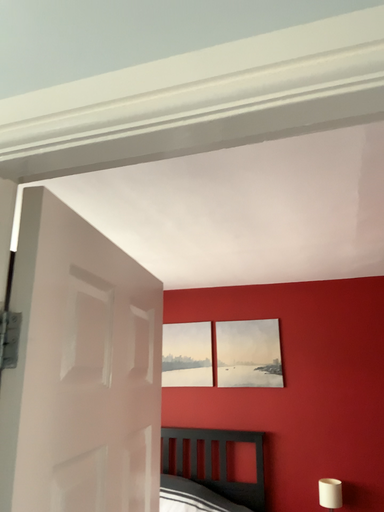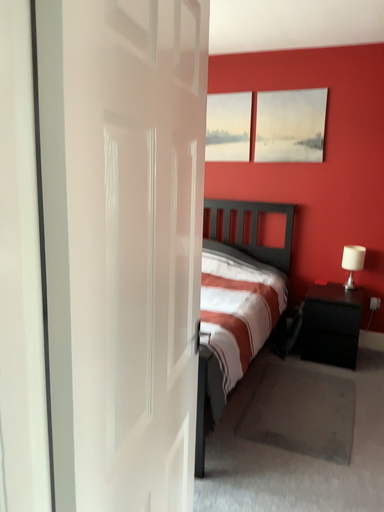
Question: How did the camera likely rotate when shooting the video?

Choices:
 (A) rotated downward
 (B) rotated upward

Answer: (A)